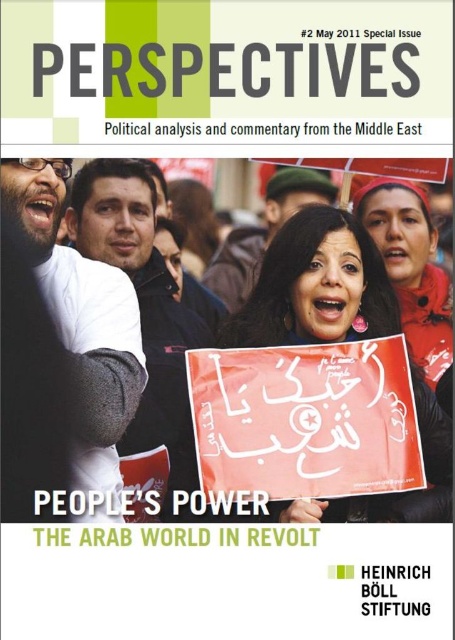
What are the coordinates of the red matte sign at center?

The red matte sign at center is located at coordinates point (317, 285).

You are a journalist reviewing the cover of the May 2011 issue of PERSPECTIVES. You notice the red matte sign at center and the matte red scarf at upper right. Based on the cover image, which object is positioned higher up in the frame?

The matte red scarf at upper right is positioned higher up in the frame than the red matte sign at center.